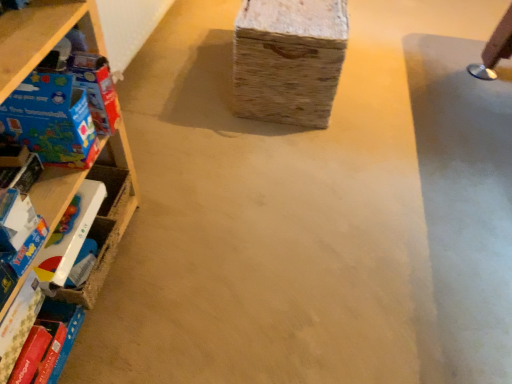
Question: From the image's perspective, is matte plastic toy at left, the first toy positioned from the bottom, positioned above or below matte plastic toy at left, marked as the 2th toy in a bottom-to-top arrangement?

Choices:
 (A) above
 (B) below

Answer: (B)

Question: Considering the positions of matte plastic toy at left, which ranks as the 4th toy in top-to-bottom order, and matte plastic toy at left, marked as the 2th toy in a bottom-to-top arrangement, in the image, is matte plastic toy at left, which ranks as the 4th toy in top-to-bottom order, taller or shorter than matte plastic toy at left, marked as the 2th toy in a bottom-to-top arrangement,?

Choices:
 (A) short
 (B) tall

Answer: (A)

Question: Which object is positioned closest to the hardcover book at lower left?

Choices:
 (A) matte cardboard box at left, the second toy when ordered from top to bottom
 (B) wooden at left
 (C) matte plastic toy at left, marked as the 2th toy in a bottom-to-top arrangement
 (D) white cardboard box at center
 (E) matte plastic toy at left, the first toy positioned from the bottom

Answer: (E)

Question: Which object is positioned farthest from the hardcover book at lower left?

Choices:
 (A) matte plastic toy at left, the first toy positioned from the bottom
 (B) matte cardboard box at left, the second toy when ordered from top to bottom
 (C) matte plastic toy at left, marked as the 2th toy in a bottom-to-top arrangement
 (D) wooden at left
 (E) blue cardboard box at left, the first toy when ordered from top to bottom

Answer: (E)